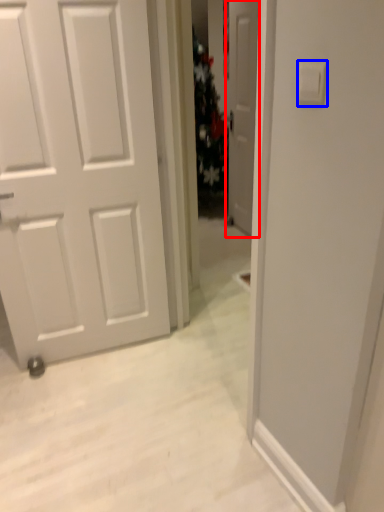
Question: Which point is closer to the camera, door (highlighted by a red box) or light switch (highlighted by a blue box)?

Choices:
 (A) door
 (B) light switch

Answer: (B)